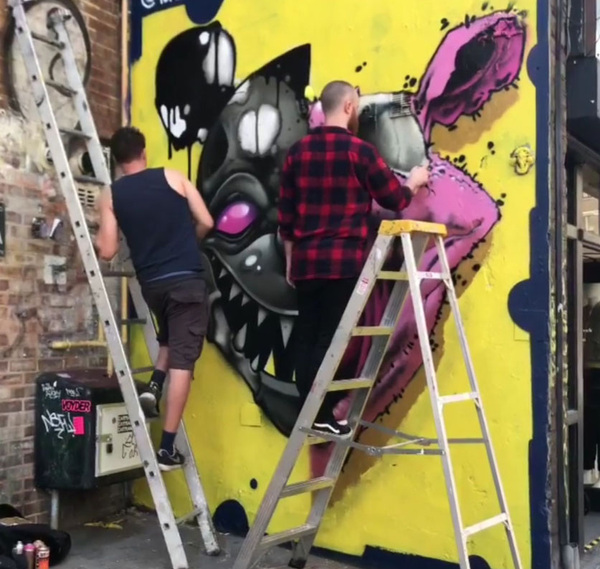
Locate an element on the screen. ladder is located at coordinates (66, 170).